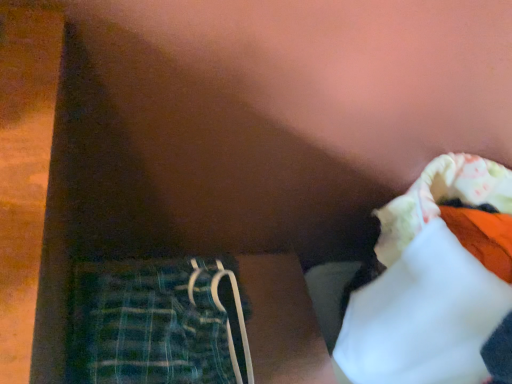
What do you see at coordinates (157, 324) in the screenshot? The height and width of the screenshot is (384, 512). I see `green plaid fabric at lower left` at bounding box center [157, 324].

I want to click on green plaid fabric at lower left, so click(157, 324).

Image resolution: width=512 pixels, height=384 pixels. What do you see at coordinates (428, 285) in the screenshot?
I see `white fabric at upper right` at bounding box center [428, 285].

In order to click on white fabric at upper right in this screenshot , I will do `click(428, 285)`.

This screenshot has width=512, height=384. I want to click on green plaid fabric at lower left, so click(157, 324).

From the picture: Visually, is green plaid fabric at lower left positioned to the left or to the right of white fabric at upper right?

In the image, green plaid fabric at lower left appears on the left side of white fabric at upper right.

Considering the positions of objects green plaid fabric at lower left and white fabric at upper right in the image provided, who is in front, green plaid fabric at lower left or white fabric at upper right?

white fabric at upper right.

Between point (247, 363) and point (509, 193), which one is positioned in front?

The point (247, 363) is more forward.

From the picture: From the image's perspective, is green plaid fabric at lower left located beneath white fabric at upper right?

Correct, green plaid fabric at lower left appears lower than white fabric at upper right in the image.

From a real-world perspective, is green plaid fabric at lower left physically located above or below white fabric at upper right?

In terms of real-world spatial position, green plaid fabric at lower left is below white fabric at upper right.

Considering the relative sizes of green plaid fabric at lower left and white fabric at upper right in the image provided, is green plaid fabric at lower left wider than white fabric at upper right?

No, green plaid fabric at lower left is not wider than white fabric at upper right.

Is green plaid fabric at lower left taller or shorter than white fabric at upper right?

green plaid fabric at lower left is shorter than white fabric at upper right.

Who is bigger, green plaid fabric at lower left or white fabric at upper right?

With larger size is white fabric at upper right.

Is white fabric at upper right located within green plaid fabric at lower left?

No, white fabric at upper right is not inside green plaid fabric at lower left.

Would you consider green plaid fabric at lower left to be distant from white fabric at upper right?

No, green plaid fabric at lower left is in close proximity to white fabric at upper right.

Is green plaid fabric at lower left positioned with its back to white fabric at upper right?

No, white fabric at upper right is not at the back of green plaid fabric at lower left.

You are a GUI agent. You are given a task and a screenshot of the screen. Output one action in this format:
    pyautogui.click(x=<x>, y=<y>)
    Task: Click on the clothing above the green plaid fabric at lower left (from a real-world perspective)
    Image resolution: width=512 pixels, height=384 pixels.
    Given the screenshot: What is the action you would take?
    pyautogui.click(x=428, y=285)

Which object is positioned more to the left, white fabric at upper right or green plaid fabric at lower left?

green plaid fabric at lower left is more to the left.

Relative to green plaid fabric at lower left, is white fabric at upper right in front or behind?

Clearly, white fabric at upper right is in front of green plaid fabric at lower left.

Is point (467, 315) farther from viewer compared to point (132, 336)?

No.

From the picture: From the image's perspective, which one is positioned lower, white fabric at upper right or green plaid fabric at lower left?

green plaid fabric at lower left.

From a real-world perspective, which is physically above, white fabric at upper right or green plaid fabric at lower left?

In real-world perspective, white fabric at upper right is above.

Is white fabric at upper right thinner than green plaid fabric at lower left?

Incorrect, the width of white fabric at upper right is not less than that of green plaid fabric at lower left.

Between white fabric at upper right and green plaid fabric at lower left, which one has less height?

With less height is green plaid fabric at lower left.

Who is smaller, white fabric at upper right or green plaid fabric at lower left?

green plaid fabric at lower left.

Can we say white fabric at upper right lies outside green plaid fabric at lower left?

white fabric at upper right lies outside green plaid fabric at lower left's area.

In the scene shown: Would you consider white fabric at upper right to be distant from green plaid fabric at lower left?

white fabric at upper right is actually quite close to green plaid fabric at lower left.

Is white fabric at upper right positioned with its back to green plaid fabric at lower left?

No, green plaid fabric at lower left is not at the back of white fabric at upper right.

What's the angular difference between white fabric at upper right and green plaid fabric at lower left's facing directions?

There is a 1.33-degree angle between the facing directions of white fabric at upper right and green plaid fabric at lower left.

Find the location of `clothing above the green plaid fabric at lower left (from a real-world perspective)`. clothing above the green plaid fabric at lower left (from a real-world perspective) is located at coordinates (428, 285).

This screenshot has width=512, height=384. In order to click on trousers below the white fabric at upper right (from the image's perspective) in this screenshot , I will do `click(157, 324)`.

The height and width of the screenshot is (384, 512). I want to click on trousers below the white fabric at upper right (from a real-world perspective), so click(x=157, y=324).